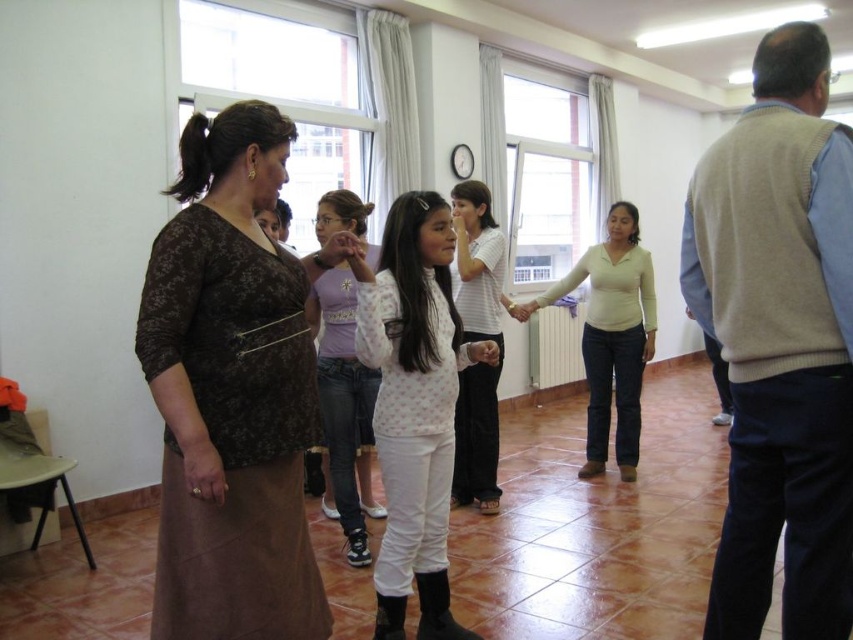
You are a photographer setting up a camera in the room. You need to ensure that the white matte sweater at center and the light purple denim jeans at center are both fully visible in the frame. Based on their sizes, which one requires more horizontal space in the camera frame?

The white matte sweater at center might be wider than light purple denim jeans at center, so it requires more horizontal space in the camera frame to ensure full visibility.

You are standing in the room and want to find the white matte sweater at center. According to the coordinates given, where should you look relative to the center of the room?

The white matte sweater at center is located at coordinates approximately 0.525 on the x axis and 0.717 on the y axis, which is slightly to the right and above the center point of the room.